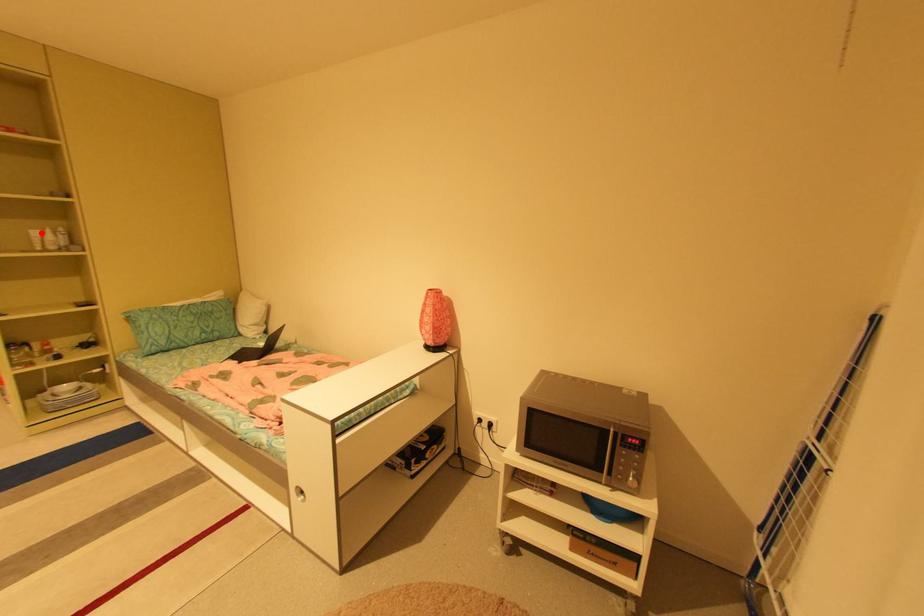
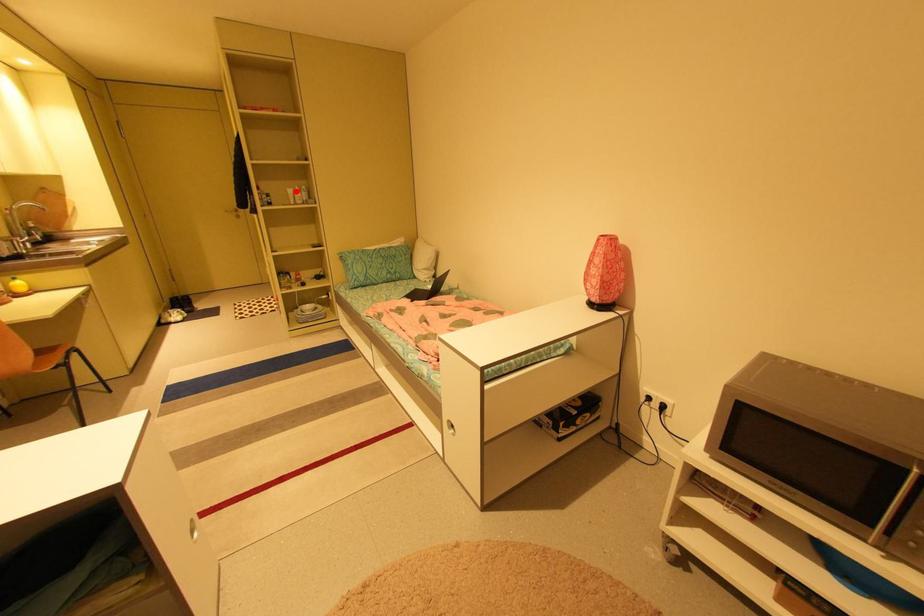
I am providing you with two images of the same scene from different viewpoints. A red point is marked on the first image and another point is marked on the second image. Is the marked point in image1 the same physical position as the marked point in image2?

Yes